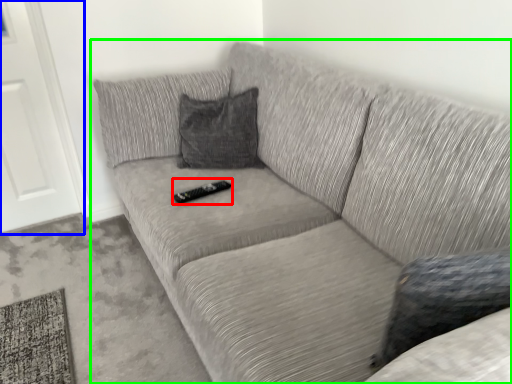
Question: Which is farther away from remote (highlighted by a red box)? door (highlighted by a blue box) or studio couch (highlighted by a green box)?

Choices:
 (A) door
 (B) studio couch

Answer: (A)